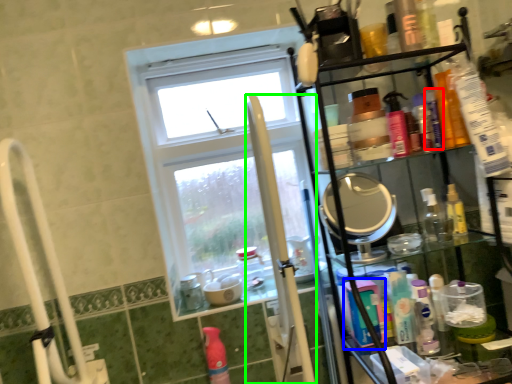
Question: Which object is positioned farthest from toiletry (highlighted by a red box)? Select from mouthwash (highlighted by a blue box) and pole (highlighted by a green box).

Choices:
 (A) mouthwash
 (B) pole

Answer: (B)